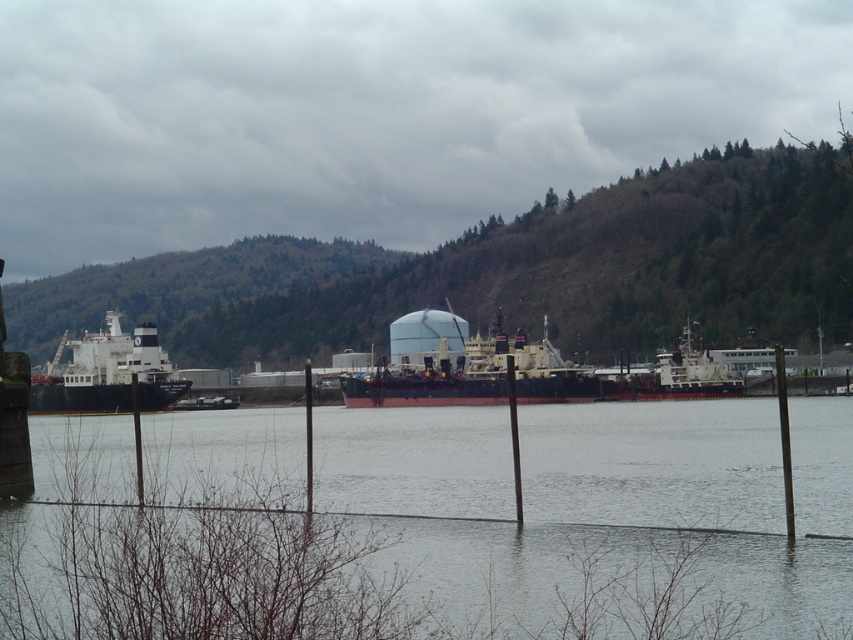
Which of these two, reddish-brown metallic ship at center or white matte ship at left, stands shorter?

Standing shorter between the two is reddish-brown metallic ship at center.

Is point (495, 401) positioned after point (96, 348)?

That is False.

The width and height of the screenshot is (853, 640). What are the coordinates of `reddish-brown metallic ship at center` in the screenshot? It's located at (531, 376).

Which is more to the right, clear water at center or white matte ship at left?

clear water at center is more to the right.

Measure the distance between point (200, 595) and camera.

43.29 feet

At what (x,y) coordinates should I click in order to perform the action: click on clear water at center. Please return your answer as a coordinate pair (x, y). The image size is (853, 640). Looking at the image, I should click on (474, 532).

At what (x,y) coordinates should I click in order to perform the action: click on clear water at center. Please return your answer as a coordinate pair (x, y). This screenshot has height=640, width=853. Looking at the image, I should click on (474, 532).

Who is positioned more to the right, clear water at center or reddish-brown metallic ship at center?

From the viewer's perspective, reddish-brown metallic ship at center appears more on the right side.

Which of these two, clear water at center or reddish-brown metallic ship at center, stands shorter?

clear water at center is shorter.

At what (x,y) coordinates should I click in order to perform the action: click on clear water at center. Please return your answer as a coordinate pair (x, y). Image resolution: width=853 pixels, height=640 pixels. Looking at the image, I should click on (474, 532).

Identify the location of clear water at center. This screenshot has width=853, height=640. (474, 532).